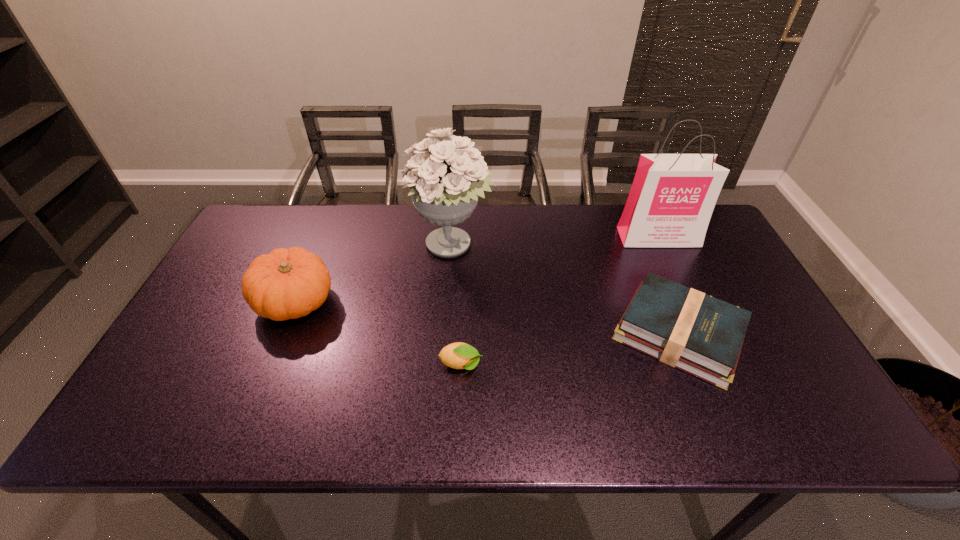
Identify the location of free space located with leaves positioned above the lemon. (578, 365).

Find the location of a particular element. This screenshot has height=540, width=960. bouquet that is at the far edge is located at coordinates (x=445, y=186).

Where is `shopping bag that is at the far edge`? Image resolution: width=960 pixels, height=540 pixels. shopping bag that is at the far edge is located at coordinates (672, 198).

The width and height of the screenshot is (960, 540). Find the location of `object that is at the left edge`. object that is at the left edge is located at coordinates (290, 283).

The image size is (960, 540). In order to click on shopping bag located at the right edge in this screenshot , I will do `click(672, 198)`.

Find the location of `hardback book that is at the right edge`. hardback book that is at the right edge is located at coordinates (687, 329).

The image size is (960, 540). In order to click on object located at the far right corner in this screenshot , I will do `click(672, 198)`.

Image resolution: width=960 pixels, height=540 pixels. I want to click on vacant space at the far edge of the desktop, so click(x=608, y=242).

What are the coordinates of `vacant space at the left edge` in the screenshot? It's located at (202, 314).

Identify the location of free space at the right edge. Image resolution: width=960 pixels, height=540 pixels. (798, 384).